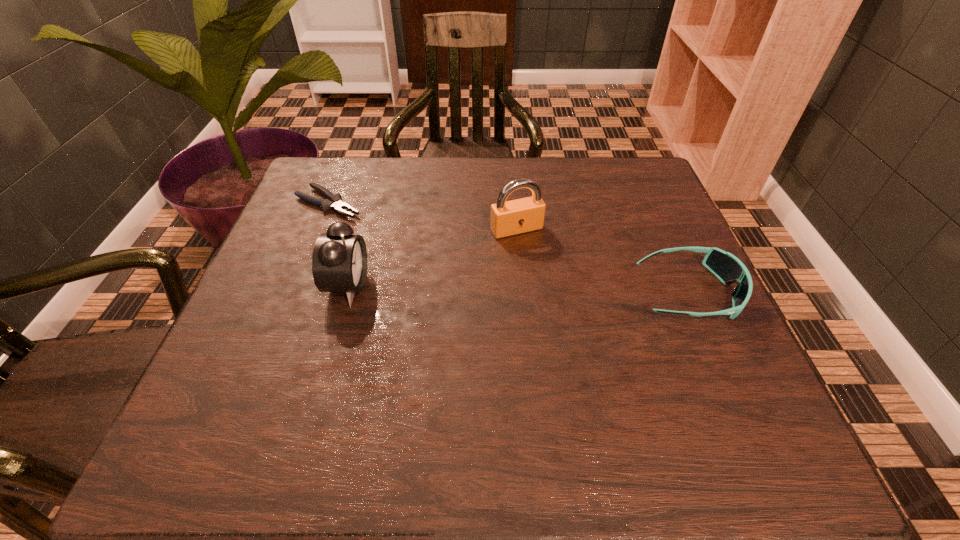
Where is `free space between the pliers and the sunglasses`? This screenshot has width=960, height=540. free space between the pliers and the sunglasses is located at coordinates (509, 248).

What are the coordinates of `free space between the shortest object and the third object from left to right` in the screenshot? It's located at (422, 216).

Locate an element on the screen. Image resolution: width=960 pixels, height=540 pixels. free space between the sunglasses and the alarm clock is located at coordinates (518, 289).

Identify which object is the second closest to the sunglasses. Please provide its 2D coordinates. Your answer should be formatted as a tuple, i.e. [(x, y)], where the tuple contains the x and y coordinates of a point satisfying the conditions above.

[(339, 260)]

You are a GUI agent. You are given a task and a screenshot of the screen. Output one action in this format:
    pyautogui.click(x=<x>, y=<y>)
    Task: Click on the third closest object to the alarm clock
    The width and height of the screenshot is (960, 540).
    Given the screenshot: What is the action you would take?
    pyautogui.click(x=725, y=266)

The width and height of the screenshot is (960, 540). In order to click on free spot that satisfies the following two spatial constraints: 1. on the front side of the third tallest object; 2. on the front-facing side of the third object from left to right in this screenshot , I will do `click(522, 293)`.

Locate an element on the screen. blank area in the image that satisfies the following two spatial constraints: 1. on the front side of the second shortest object; 2. on the front-facing side of the padlock is located at coordinates (522, 293).

Find the location of `vacant region that satisfies the following two spatial constraints: 1. on the front side of the sunglasses; 2. on the front-facing side of the second object from right to left`. vacant region that satisfies the following two spatial constraints: 1. on the front side of the sunglasses; 2. on the front-facing side of the second object from right to left is located at coordinates (522, 293).